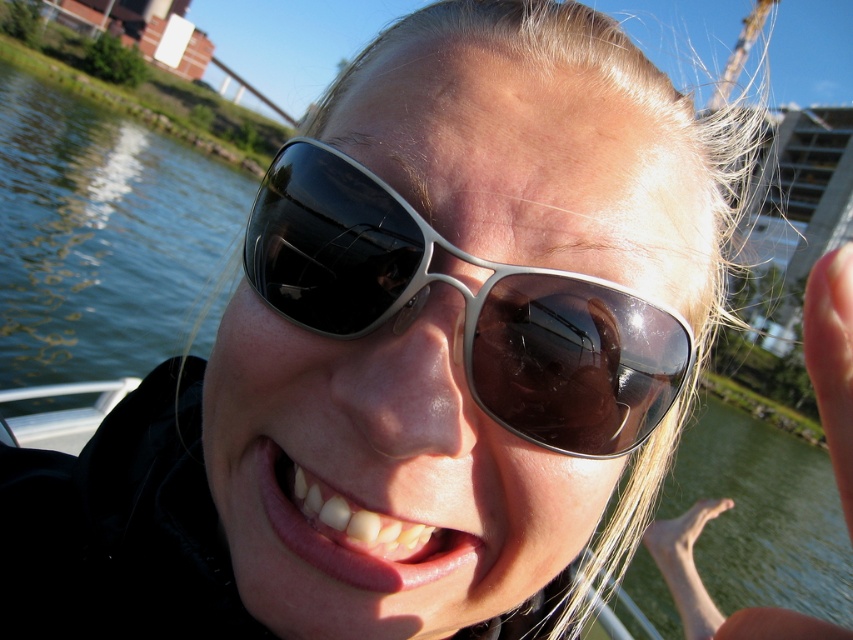
Does point (538, 444) come farther from viewer compared to point (312, 513)?

No.

Can you confirm if metallic silver aviator sunglasses at center is smaller than pink glossy lips at center?

Incorrect, metallic silver aviator sunglasses at center is not smaller in size than pink glossy lips at center.

Describe the element at coordinates (465, 307) in the screenshot. I see `metallic silver aviator sunglasses at center` at that location.

The width and height of the screenshot is (853, 640). Identify the location of metallic silver aviator sunglasses at center. (465, 307).

Looking at this image, is clear water at lower left in front of pink glossy lips at center?

No, it is not.

Is point (180, 260) positioned behind point (393, 529)?

Yes.

Find the location of a particular element. Image resolution: width=853 pixels, height=640 pixels. clear water at lower left is located at coordinates (103, 237).

Does metallic silver aviator sunglasses at center have a larger size compared to clear water at lower left?

Actually, metallic silver aviator sunglasses at center might be smaller than clear water at lower left.

Between metallic silver aviator sunglasses at center and clear water at lower left, which one has more height?

With more height is clear water at lower left.

The width and height of the screenshot is (853, 640). I want to click on metallic silver aviator sunglasses at center, so click(465, 307).